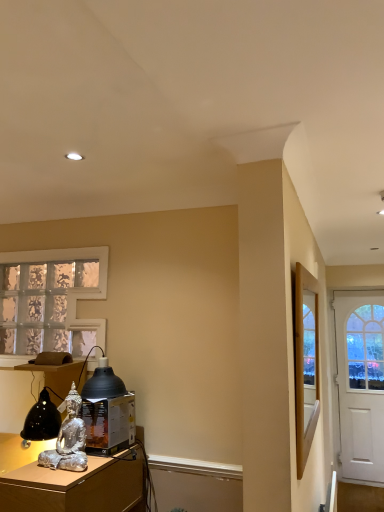
Question: Is white matte door at right to the left or to the right of silver metallic statue at lower left in the image?

Choices:
 (A) right
 (B) left

Answer: (A)

Question: Considering the positions of white matte door at right and silver metallic statue at lower left in the image, is white matte door at right wider or thinner than silver metallic statue at lower left?

Choices:
 (A) thin
 (B) wide

Answer: (A)

Question: Estimate the real-world distances between objects in this image. Which object is closer to the silver metallic statue at lower left?

Choices:
 (A) wooden framed mirror at right
 (B) white matte door at right
 (C) silver metallic statue at lower left
 (D) matte black lampshade at lower left
 (E) translucent glass window at left

Answer: (C)

Question: Which is nearer to the matte black lampshade at lower left?

Choices:
 (A) wooden framed mirror at right
 (B) silver metallic statue at lower left
 (C) translucent glass window at left
 (D) white matte door at right
 (E) silver metallic statue at lower left

Answer: (E)